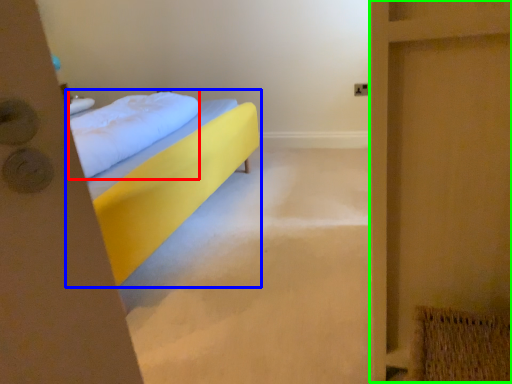
Question: Which object is the farthest from pillow (highlighted by a red box)? Choose among these: bed (highlighted by a blue box) or screen door (highlighted by a green box).

Choices:
 (A) bed
 (B) screen door

Answer: (B)